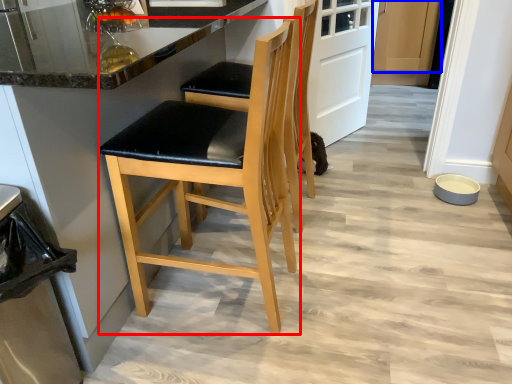
Question: Which of the following is the farthest to the observer, chair (highlighted by a red box) or cabinetry (highlighted by a blue box)?

Choices:
 (A) chair
 (B) cabinetry

Answer: (B)